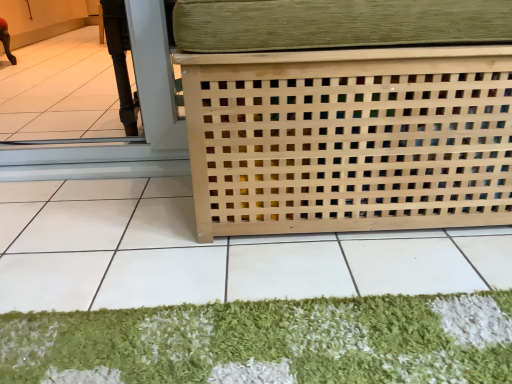
Question: Does natural wood lattice at center turn towards natural wood lattice at center?

Choices:
 (A) no
 (B) yes

Answer: (A)

Question: Does natural wood lattice at center have a greater height compared to natural wood lattice at center?

Choices:
 (A) yes
 (B) no

Answer: (A)

Question: Does natural wood lattice at center have a lesser width compared to natural wood lattice at center?

Choices:
 (A) no
 (B) yes

Answer: (B)

Question: Does natural wood lattice at center have a lesser height compared to natural wood lattice at center?

Choices:
 (A) no
 (B) yes

Answer: (A)

Question: Does natural wood lattice at center have a greater width compared to natural wood lattice at center?

Choices:
 (A) yes
 (B) no

Answer: (B)

Question: Is point (333, 362) closer or farther from the camera than point (187, 253)?

Choices:
 (A) farther
 (B) closer

Answer: (B)

Question: Is green shaggy mat at lower center in front of or behind natural wood lattice at center in the image?

Choices:
 (A) behind
 (B) front

Answer: (A)

Question: Considering the positions of green shaggy mat at lower center and natural wood lattice at center in the image, is green shaggy mat at lower center bigger or smaller than natural wood lattice at center?

Choices:
 (A) small
 (B) big

Answer: (A)

Question: Is green shaggy mat at lower center to the left or to the right of natural wood lattice at center in the image?

Choices:
 (A) right
 (B) left

Answer: (A)

Question: Does point (170, 208) appear closer or farther from the camera than point (312, 228)?

Choices:
 (A) farther
 (B) closer

Answer: (A)

Question: In the image, is natural wood lattice at center on the left side or the right side of natural wood lattice at center?

Choices:
 (A) left
 (B) right

Answer: (A)

Question: Is natural wood lattice at center taller or shorter than natural wood lattice at center?

Choices:
 (A) short
 (B) tall

Answer: (A)

Question: Would you say natural wood lattice at center is inside or outside natural wood lattice at center?

Choices:
 (A) inside
 (B) outside

Answer: (B)

Question: From their relative heights in the image, would you say natural wood lattice at center is taller or shorter than green shaggy mat at lower center?

Choices:
 (A) tall
 (B) short

Answer: (A)

Question: Is point (242, 28) closer or farther from the camera than point (393, 352)?

Choices:
 (A) farther
 (B) closer

Answer: (A)